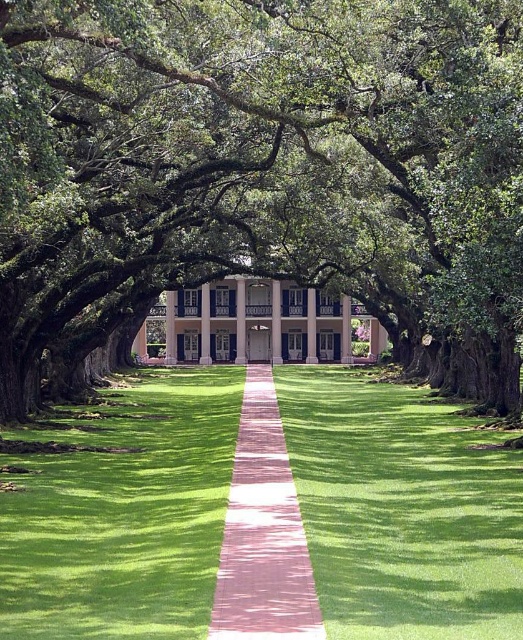
Question: Is green grass at center smaller than pink brick path at center?

Choices:
 (A) yes
 (B) no

Answer: (B)

Question: Which object appears closest to the camera in this image?

Choices:
 (A) green grass at center
 (B) green leafy tree at center

Answer: (A)

Question: Is green grass at center closer to camera compared to pink brick path at center?

Choices:
 (A) no
 (B) yes

Answer: (A)

Question: Which of these objects is positioned closest to the green grass at center?

Choices:
 (A) green leafy tree at center
 (B) pink brick path at center

Answer: (B)

Question: Based on their relative distances, which object is nearer to the pink brick path at center?

Choices:
 (A) green grass at center
 (B) green leafy tree at center

Answer: (A)

Question: Is green leafy tree at center above green grass at center?

Choices:
 (A) no
 (B) yes

Answer: (B)